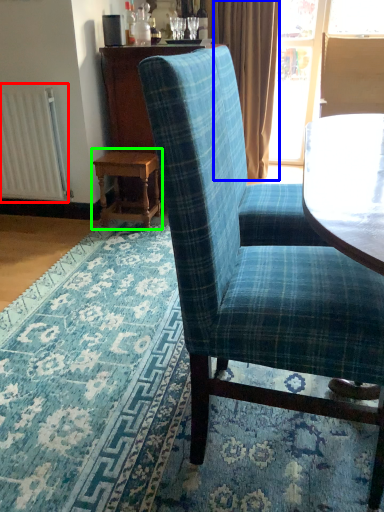
Question: Which object is positioned closest to radiator (highlighted by a red box)? Select from curtain (highlighted by a blue box) and table (highlighted by a green box).

Choices:
 (A) curtain
 (B) table

Answer: (B)